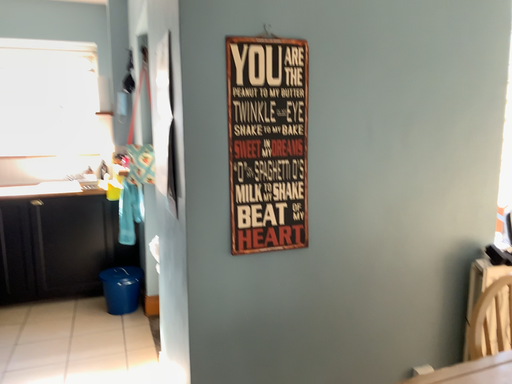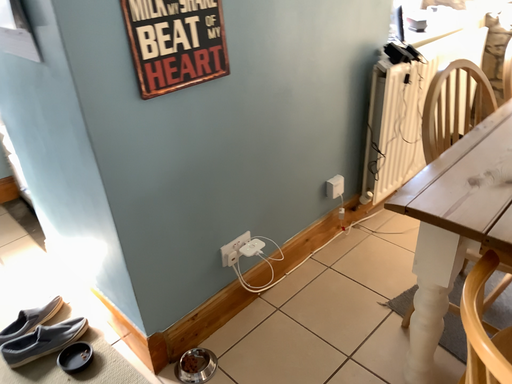
Question: How did the camera likely rotate when shooting the video?

Choices:
 (A) rotated upward
 (B) rotated downward

Answer: (B)